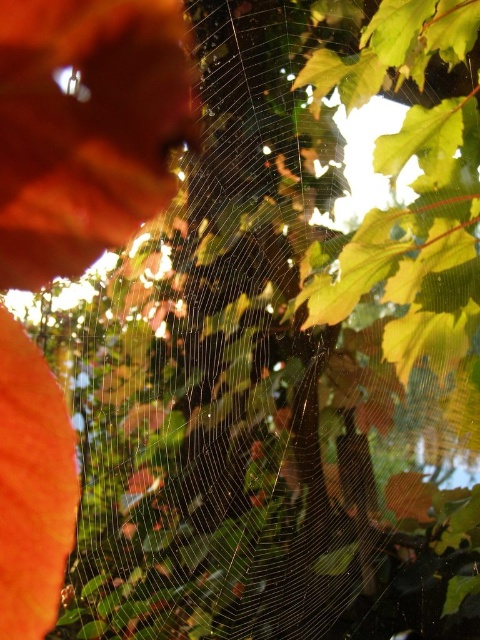
You are an entomologist examining the spider web. You notice two points on the web labeled as point (83, 44) and point (12, 337). Which point is closer to your viewpoint?

Point (83, 44) is in front of point (12, 337), so it is closer to your viewpoint.

You are an insect trying to navigate through the spider web. You notice two orange leaves nearby. Which leaf, the matte orange leaf at upper left or the orange matte leaf at left, is closer to the web?

The matte orange leaf at upper left is shorter than the orange matte leaf at left, so the matte orange leaf at upper left is closer to the web.